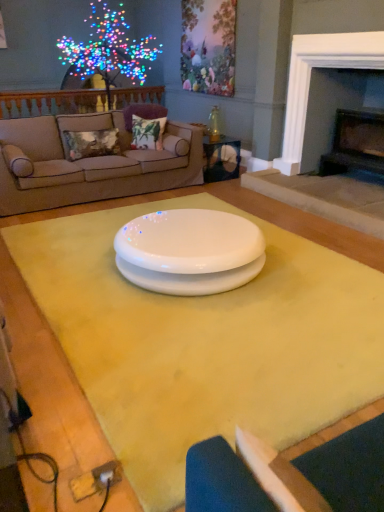
Question: From a real-world perspective, is white fabric armchair at lower right beneath white glossy table at center, which is the 1th table from top to bottom?

Choices:
 (A) no
 (B) yes

Answer: (A)

Question: Does white fabric armchair at lower right have a smaller size compared to white glossy table at center, which is the 1th table from top to bottom?

Choices:
 (A) no
 (B) yes

Answer: (B)

Question: From a real-world perspective, is white fabric armchair at lower right physically above white glossy table at center, positioned as the 2th table in front-to-back order?

Choices:
 (A) no
 (B) yes

Answer: (B)

Question: Is the depth of white fabric armchair at lower right greater than that of white glossy table at center, marked as the first table in a back-to-front arrangement?

Choices:
 (A) no
 (B) yes

Answer: (A)

Question: Is white fabric armchair at lower right shorter than white glossy table at center, marked as the first table in a back-to-front arrangement?

Choices:
 (A) no
 (B) yes

Answer: (B)

Question: Is white fabric armchair at lower right to the right of white glossy table at center, positioned as the 2th table in front-to-back order, from the viewer's perspective?

Choices:
 (A) no
 (B) yes

Answer: (A)

Question: Can you confirm if dark gray stone fireplace at upper right, arranged as the 2th fireplace when viewed from the right, is thinner than beige fabric couch at upper left?

Choices:
 (A) no
 (B) yes

Answer: (A)

Question: Can we say dark gray stone fireplace at upper right, arranged as the 1th fireplace when viewed from the left, lies outside beige fabric couch at upper left?

Choices:
 (A) yes
 (B) no

Answer: (A)

Question: Is dark gray stone fireplace at upper right, arranged as the 2th fireplace when viewed from the right, in front of beige fabric couch at upper left?

Choices:
 (A) no
 (B) yes

Answer: (B)

Question: Is dark gray stone fireplace at upper right, arranged as the 2th fireplace when viewed from the right, aimed at beige fabric couch at upper left?

Choices:
 (A) yes
 (B) no

Answer: (B)

Question: Does dark gray stone fireplace at upper right, arranged as the 1th fireplace when viewed from the left, have a smaller size compared to beige fabric couch at upper left?

Choices:
 (A) no
 (B) yes

Answer: (A)

Question: Considering the relative sizes of dark gray stone fireplace at upper right, arranged as the 1th fireplace when viewed from the left, and beige fabric couch at upper left in the image provided, is dark gray stone fireplace at upper right, arranged as the 1th fireplace when viewed from the left, wider than beige fabric couch at upper left?

Choices:
 (A) no
 (B) yes

Answer: (B)

Question: Does white glossy plate at center come in front of yellow matte table at center, arranged as the 1th table when ordered from the bottom?

Choices:
 (A) yes
 (B) no

Answer: (B)